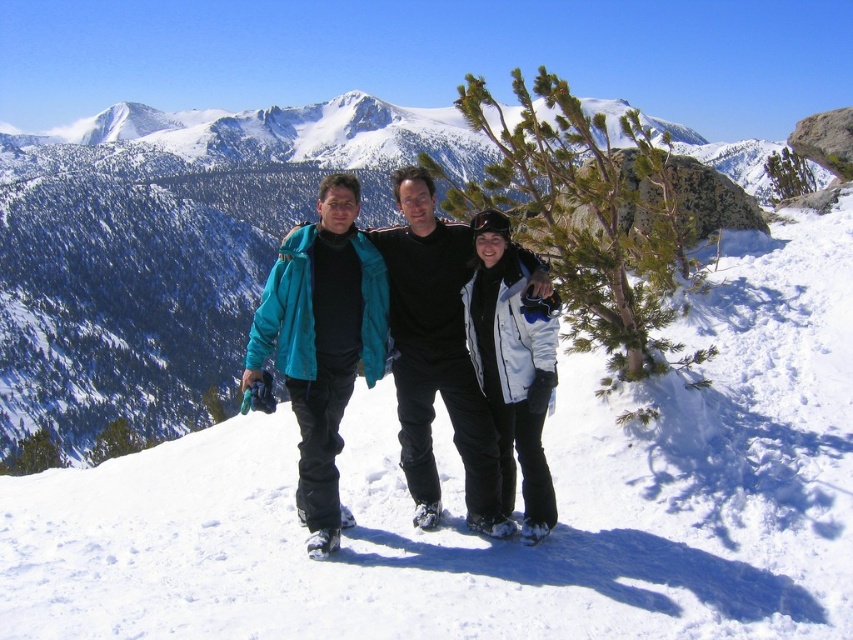
You are a photographer planning to capture a landscape shot of the white snow at center and the matte blue jacket at center. You need to ensure both are in focus. Given that your camera can focus on objects within a 10 meter range, will both subjects be in focus?

The white snow at center and the matte blue jacket at center are 13.83 meters apart from each other. Since the distance between them exceeds the camera focus range of 10 meters, both subjects cannot be in focus simultaneously.

You are standing at the base of the mountain and want to take a photo of the matte blue jacket at center. If your camera has a maximum focus range of 30 meters, will you be able to capture a clear image?

The matte blue jacket at center is 35.54 meters away from the viewer. Since the camera can only focus up to 30 meters, it won not be able to capture a clear image of the matte blue jacket at center.

You are standing at the bottom of the mountain looking up. You see the matte blue jacket at center. Where would you look to find it?

The matte blue jacket at center is located at point 0.556 on the x axis and 0.512 on the y axis.